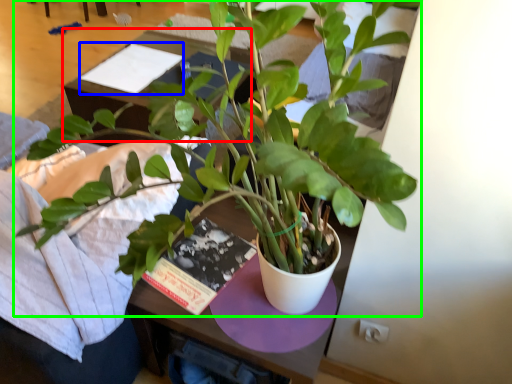
Question: Estimate the real-world distances between objects in this image. Which object is farther from table (highlighted by a red box), book (highlighted by a blue box) or houseplant (highlighted by a green box)?

Choices:
 (A) book
 (B) houseplant

Answer: (B)